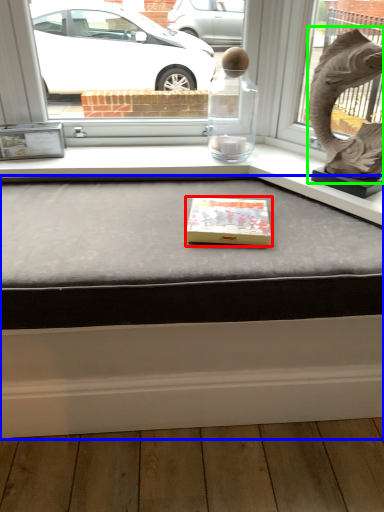
Question: Considering the real-world distances, which object is closest to box (highlighted by a red box)? table (highlighted by a blue box) or animal sculpture (highlighted by a green box).

Choices:
 (A) table
 (B) animal sculpture

Answer: (A)